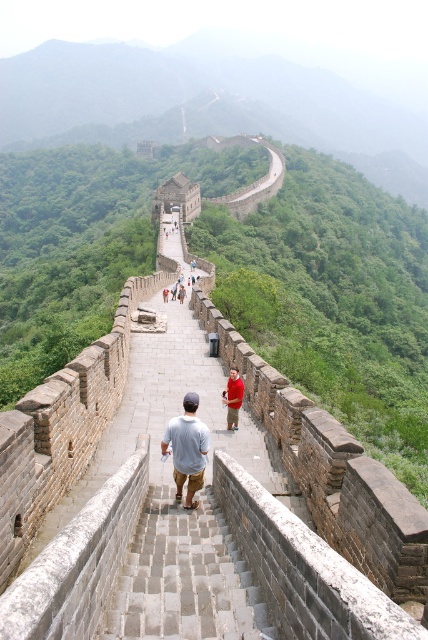
Question: From the image, what is the correct spatial relationship of light blue cotton shirt at center in relation to red cotton shirt at center?

Choices:
 (A) right
 (B) left

Answer: (B)

Question: Among these points, which one is farthest from the camera?

Choices:
 (A) (237, 372)
 (B) (193, 465)

Answer: (A)

Question: Observing the image, what is the correct spatial positioning of light blue cotton shirt at center in reference to red cotton shirt at center?

Choices:
 (A) below
 (B) above

Answer: (A)

Question: Does light blue cotton shirt at center appear under red cotton shirt at center?

Choices:
 (A) yes
 (B) no

Answer: (A)